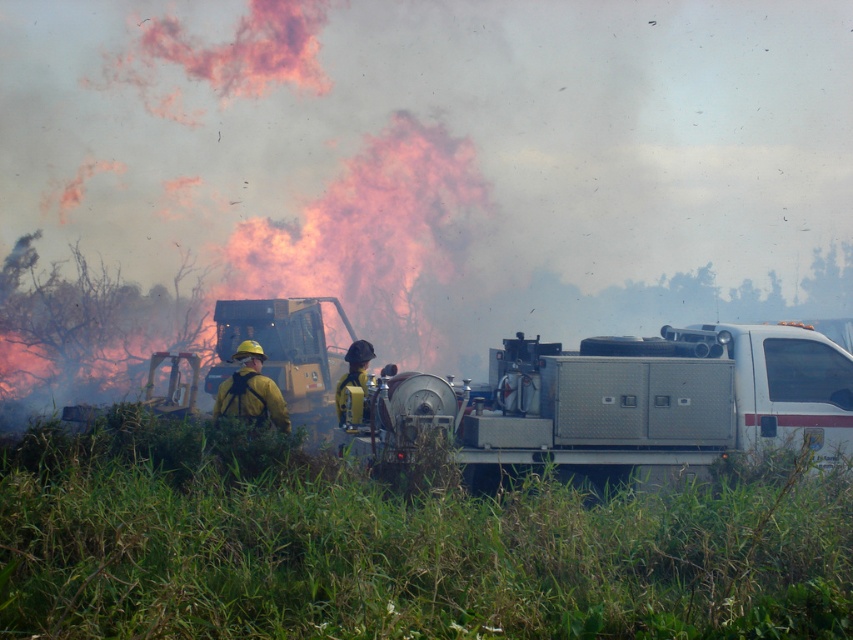
You are a drone operator tasked with monitoring the wildfire suppression operation. Your drone is currently hovering above the dense green vegetation in the foreground. You need to capture a clear photo of the yellow matte fireman at center. Based on their 2D coordinates, in which cardinal direction should you move the drone to get closer to the fireman?

The yellow matte fireman at center is located at coordinates point (251, 390). Since the drone is above the dense green vegetation in the foreground, which is in the lower part of the image, moving north would bring the drone closer to the fireman.

You are a firefighter trying to assess the situation. You see the silver metallic fire truck at center and the yellow matte fireman at center. Which object is taller?

The silver metallic fire truck at center is taller than the yellow matte fireman at center.